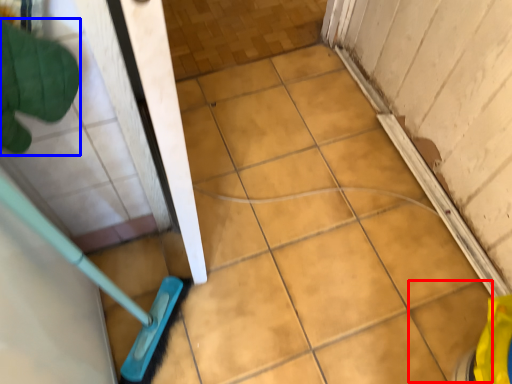
Question: Which object appears farthest to the camera in this image, ceramic tile (highlighted by a red box) or hand (highlighted by a blue box)?

Choices:
 (A) ceramic tile
 (B) hand

Answer: (A)